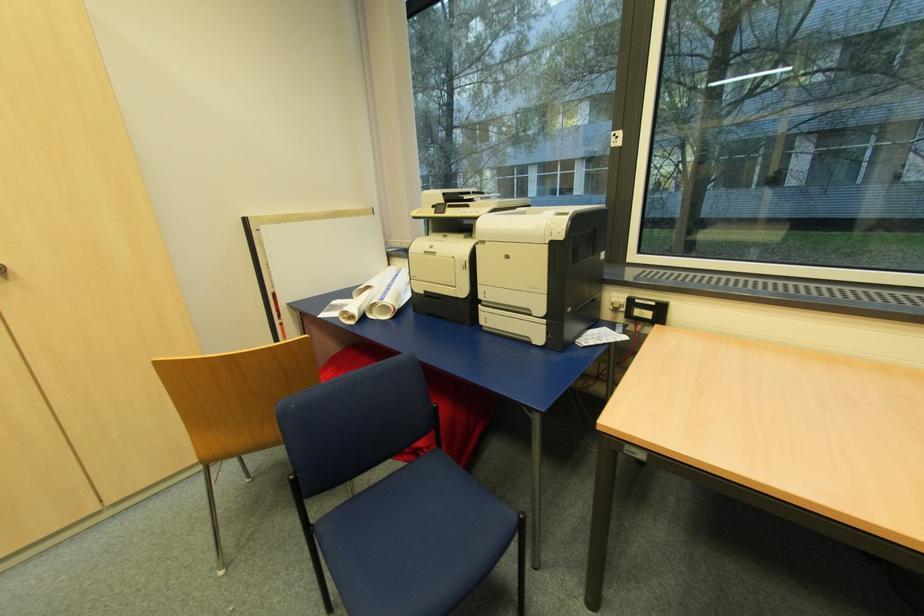
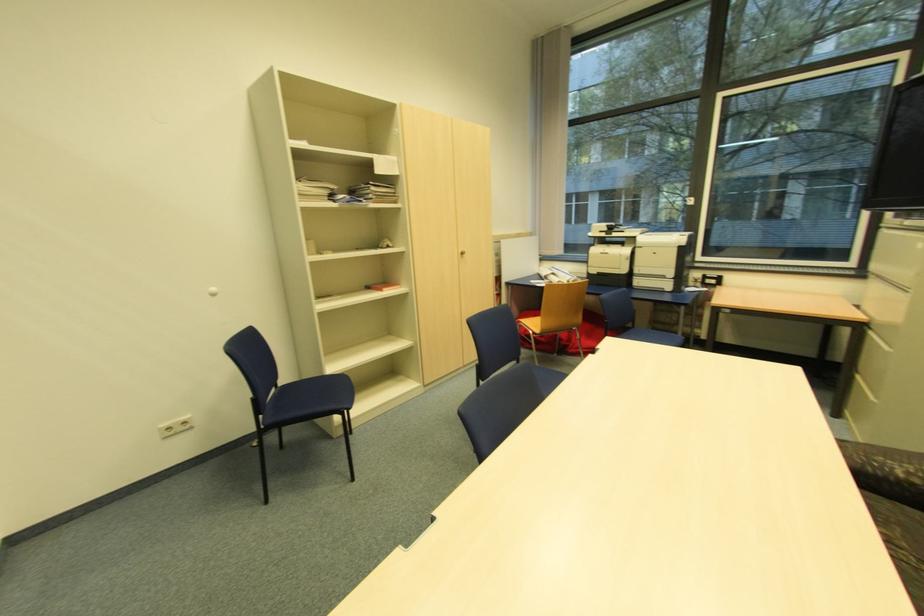
The images are taken continuously from a first-person perspective. In which direction are you moving?

The cameraman walked toward left, backward.